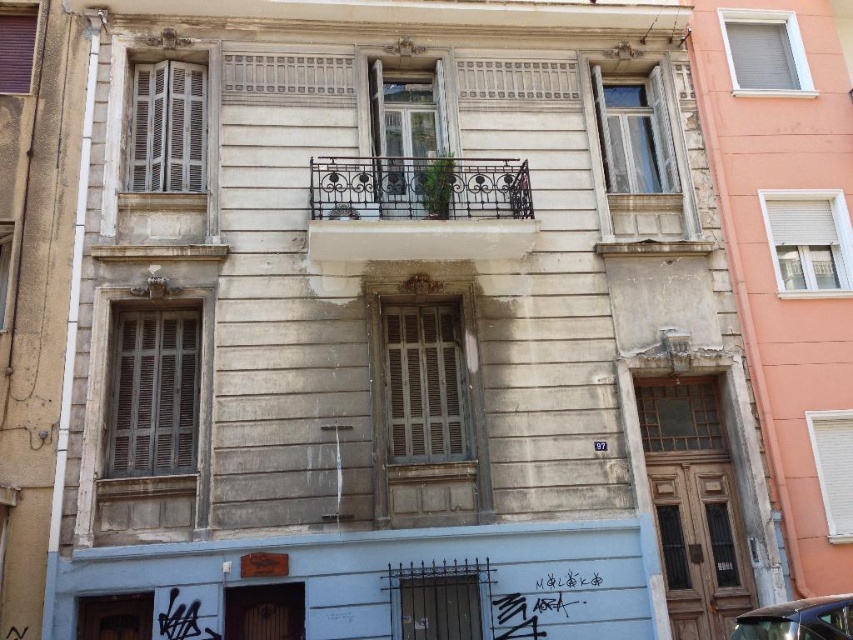
You are standing in front of the building and see the point marked at coordinates (418,209). What does this point represent?

The point at coordinates (418,209) represents the black wrought iron balcony at center.

Consider the image. You are a delivery person standing next to the shiny black car at lower right. You need to deliver a package to the apartment above you. Is the black wrought iron balcony at center directly above your location?

Yes, the black wrought iron balcony at center is positioned over the shiny black car at lower right, which means it is directly above your current location.

You are a delivery person with a package that requires a 5 meter clearance to deliver. You are standing next to the shiny black car at lower right and need to reach the black wrought iron balcony at center. Can you navigate the space between them without needing to move any objects?

The distance between the black wrought iron balcony at center and the shiny black car at lower right is 4.96 meters. Since the required clearance is 5 meters, the delivery person cannot navigate the space as the distance is slightly less than required.